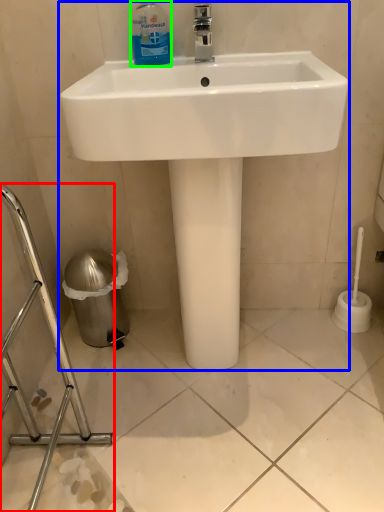
Question: Based on their relative distances, which object is nearer to porcelain (highlighted by a red box)? Choose from sink (highlighted by a blue box) and cleaning product (highlighted by a green box).

Choices:
 (A) sink
 (B) cleaning product

Answer: (A)